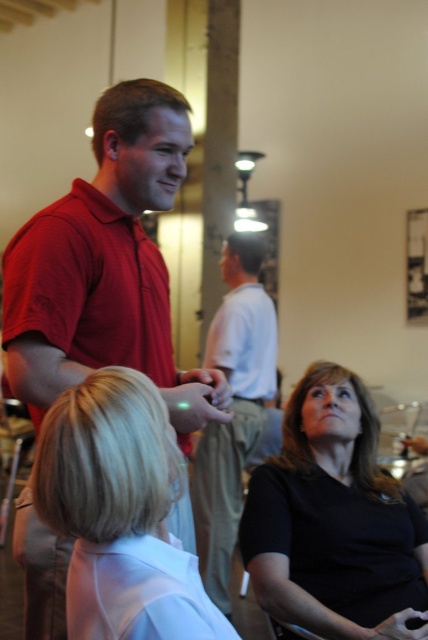
Question: Is black matte shirt at lower right bigger than blonde hair at center?

Choices:
 (A) yes
 (B) no

Answer: (A)

Question: Which object is farther from the camera taking this photo?

Choices:
 (A) light gray cotton shirt at center
 (B) black matte shirt at lower right
 (C) matte red shirt at center

Answer: (A)

Question: Is the position of black matte shirt at lower right more distant than that of blonde hair at center?

Choices:
 (A) no
 (B) yes

Answer: (B)

Question: Estimate the real-world distances between objects in this image. Which object is closer to the light gray cotton shirt at center?

Choices:
 (A) matte red shirt at center
 (B) blonde hair at center
 (C) black matte shirt at lower right

Answer: (C)

Question: Which of the following is the closest to the observer?

Choices:
 (A) (187, 634)
 (B) (38, 284)

Answer: (A)

Question: Can you confirm if matte red shirt at center is positioned below light gray cotton shirt at center?

Choices:
 (A) no
 (B) yes

Answer: (A)